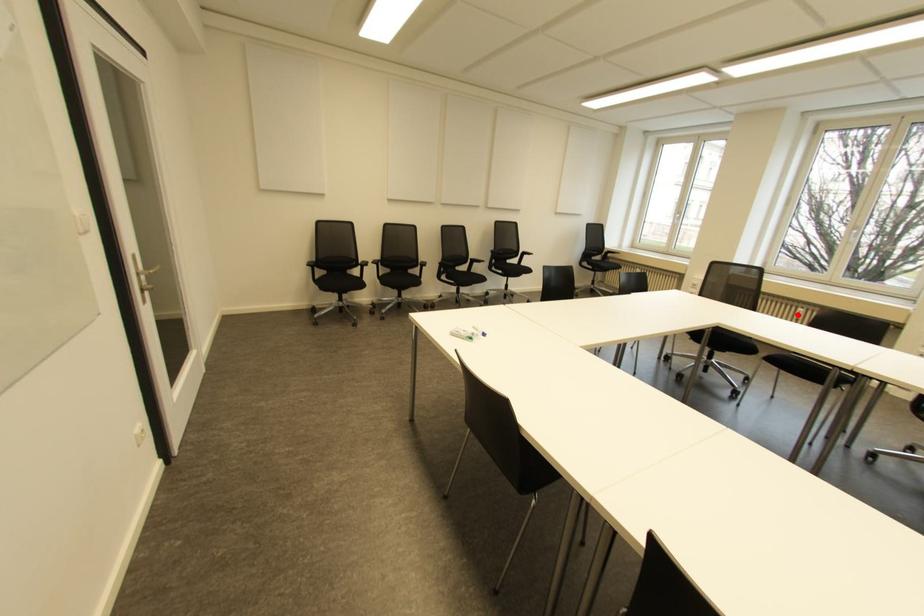
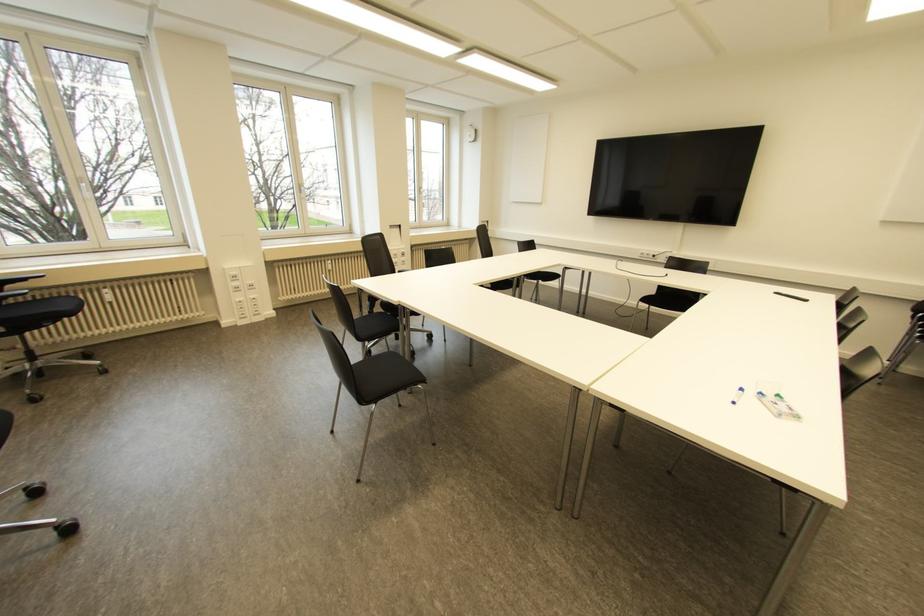
Find the pixel in the second image that matches the highlighted location in the first image.

(330, 267)